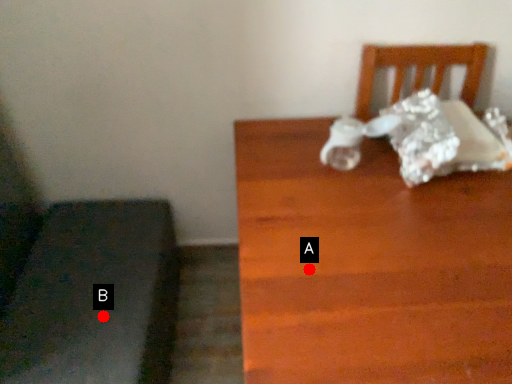
Question: Two points are circled on the image, labeled by A and B beside each circle. Which point is closer to the camera taking this photo?

Choices:
 (A) A is closer
 (B) B is closer

Answer: (A)